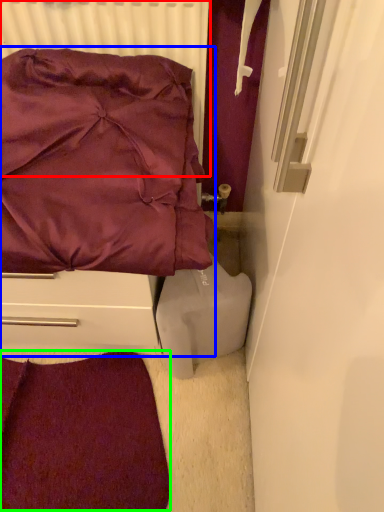
Question: Considering the real-world distances, which object is farthest from radiator (highlighted by a red box)? furniture (highlighted by a blue box) or violet (highlighted by a green box)?

Choices:
 (A) furniture
 (B) violet

Answer: (B)